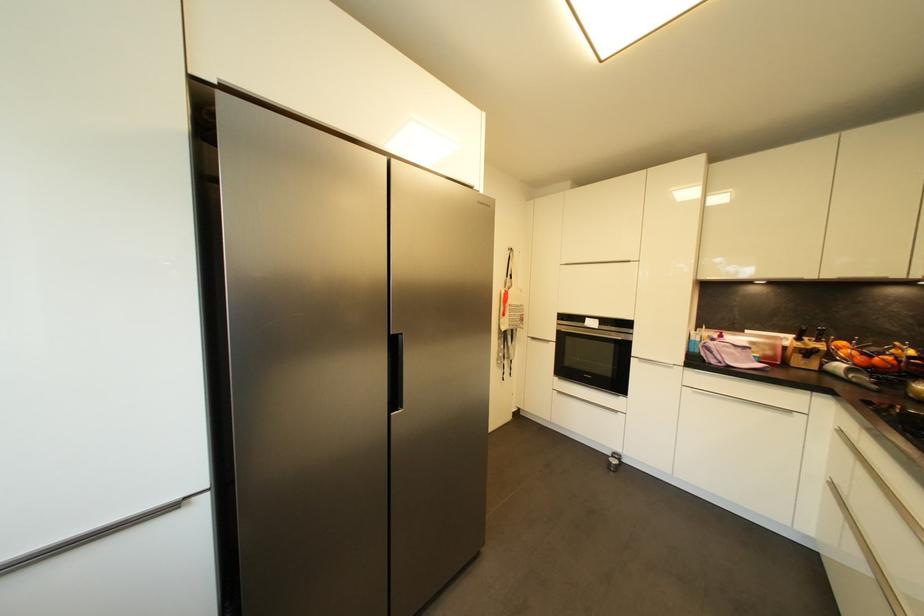
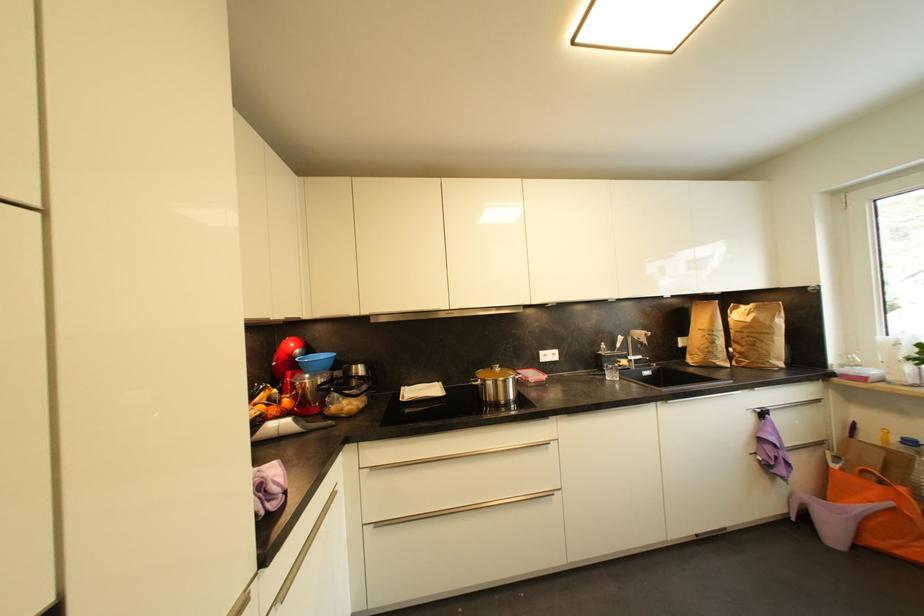
Where in the second image is the point corresponding to pixel 867 361 from the first image?

(277, 411)